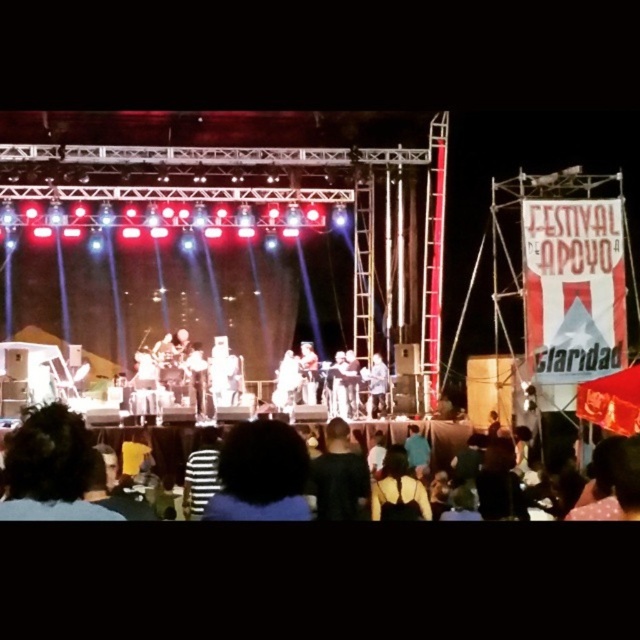
You are a photographer at the concert and want to capture a clear shot of the dark brown leather jacket at center without the light brown wooden guitar at center blocking it. What should you do?

Move to a position where the dark brown leather jacket at center is no longer behind the light brown wooden guitar at center. Since the dark brown leather jacket at center is currently behind the light brown wooden guitar at center, adjusting your angle or moving around the stage could allow you to frame the jacket without obstruction.

You are a photographer at the concert and want to take a photo focusing on the dark hair at center and the black matte shirt at center. Which object should you adjust your camera focus on first to ensure both are in focus?

The dark hair at center is closer to the viewer than the black matte shirt at center, so you should focus on the dark hair at center first to ensure both are in focus.